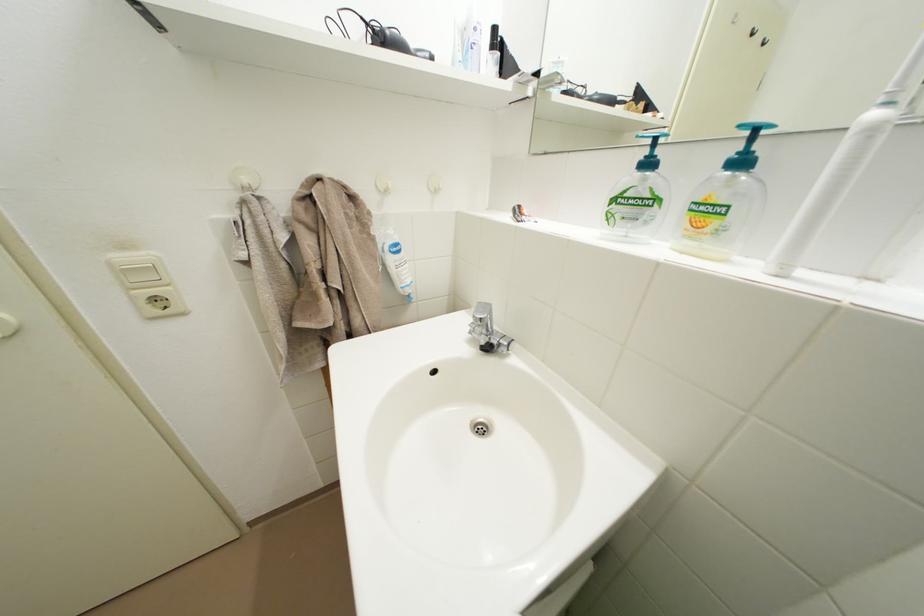
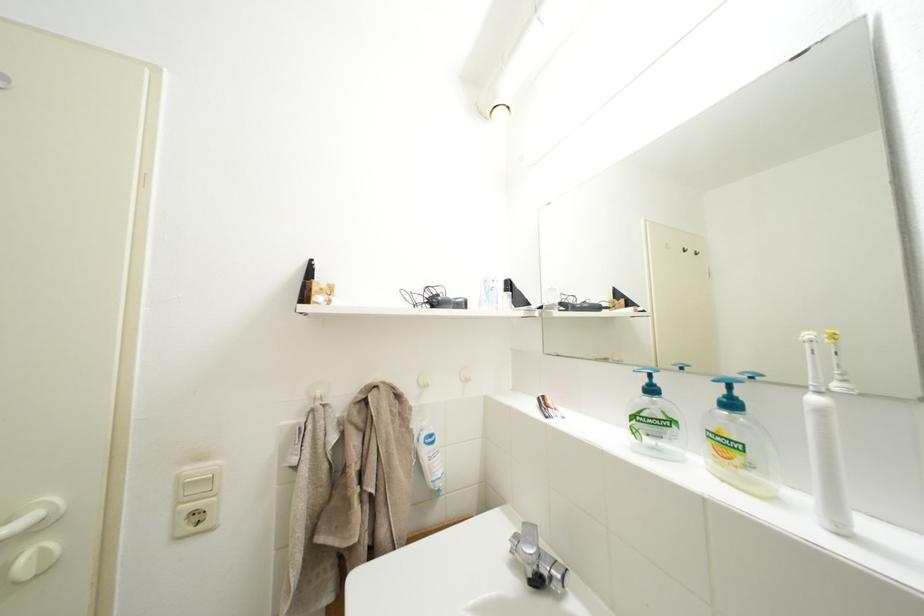
Question: Based on the continuous images, in which direction is the camera rotating? Reply with the corresponding letter.

Choices:
 (A) Left
 (B) Right
 (C) Up
 (D) Down

Answer: (C)